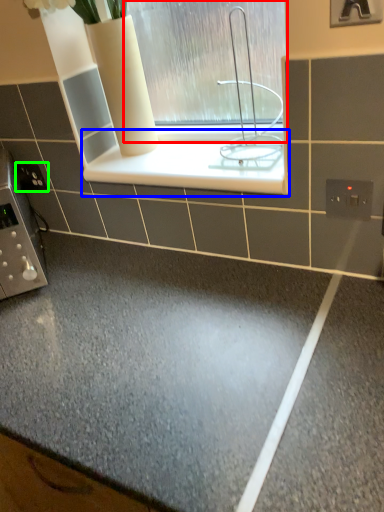
Question: Which object is the farthest from window (highlighted by a red box)? Choose among these: ledge (highlighted by a blue box) or electric outlet (highlighted by a green box).

Choices:
 (A) ledge
 (B) electric outlet

Answer: (B)